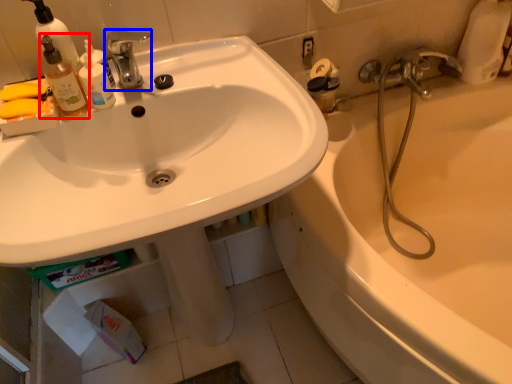
Question: Which object appears farthest to the camera in this image, bottle (highlighted by a red box) or tap (highlighted by a blue box)?

Choices:
 (A) bottle
 (B) tap

Answer: (B)